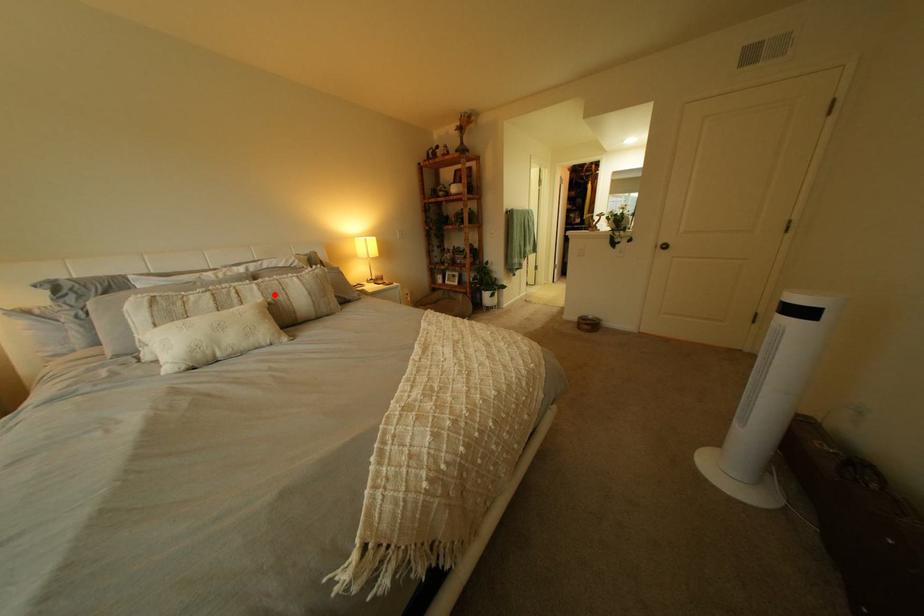
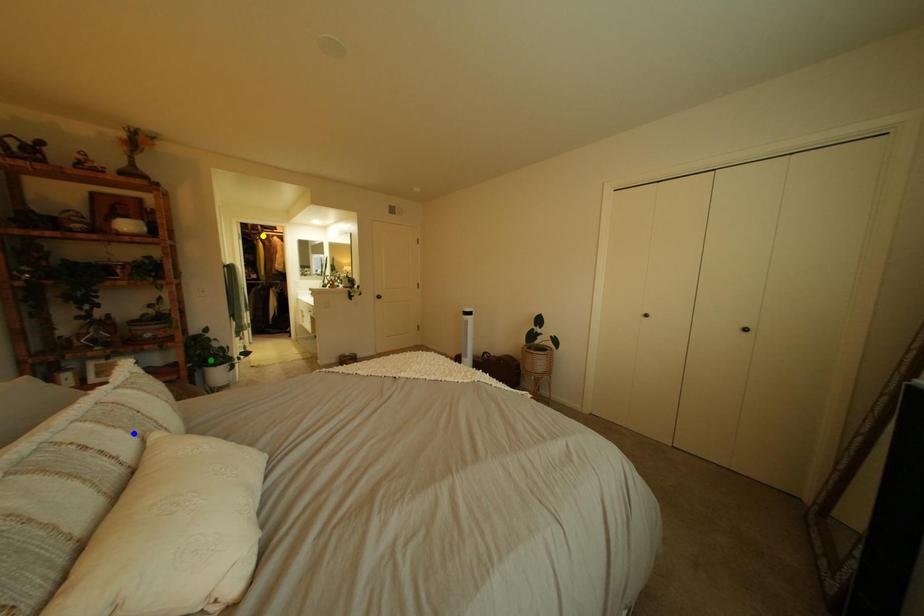
Question: I am providing you with two images of the same scene from different viewpoints. A red point is marked on the first image. You are given multiple points on the second image. Can you choose the point in image 2 that corresponds to the point in image 1?

Choices:
 (A) blue point
 (B) green point
 (C) yellow point

Answer: (A)